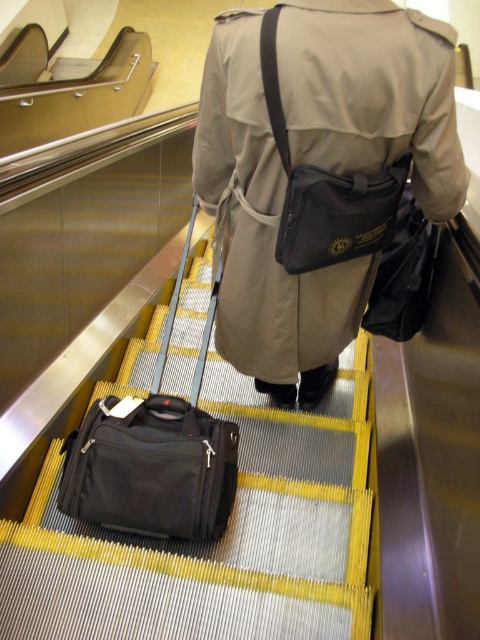
You are a traveler who just boarded an escalator and is carrying a matte black bag at center and a matte black pouch at center. You want to ensure your items are secure. Which item should you check first if you need to adjust something that requires reaching upwards?

The matte black bag at center is much taller than the matte black pouch at center, so you should check the matte black bag at center first since it requires reaching upwards.

You are an airport security agent checking the items on the escalator. You notice the matte black bag at center. Where exactly is it positioned on the escalator steps?

The matte black bag at center is located at point coordinates (264, 234) on the escalator steps.

You are a traveler standing behind the person on the escalator. You want to retrieve your black fabric suitcase at center and matte black pouch at center. Which one is closer to your right side?

The matte black pouch at center is closer to your right side because the black fabric suitcase at center is to the left of it.